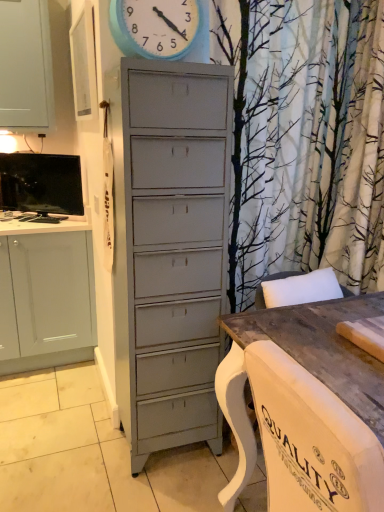
Question: Does matte black tv at upper left have a greater height compared to blue painted wood clock at upper center?

Choices:
 (A) no
 (B) yes

Answer: (B)

Question: Is matte black tv at upper left bigger than blue painted wood clock at upper center?

Choices:
 (A) yes
 (B) no

Answer: (A)

Question: Is matte black tv at upper left surrounding blue painted wood clock at upper center?

Choices:
 (A) yes
 (B) no

Answer: (B)

Question: Can you confirm if matte black tv at upper left is positioned to the left of blue painted wood clock at upper center?

Choices:
 (A) no
 (B) yes

Answer: (B)

Question: Is matte black tv at upper left positioned far away from blue painted wood clock at upper center?

Choices:
 (A) yes
 (B) no

Answer: (A)

Question: From a real-world perspective, is blue painted wood clock at upper center physically located above or below matte black tv at upper left?

Choices:
 (A) below
 (B) above

Answer: (B)

Question: In terms of height, does blue painted wood clock at upper center look taller or shorter compared to matte black tv at upper left?

Choices:
 (A) tall
 (B) short

Answer: (B)

Question: Relative to matte black tv at upper left, is blue painted wood clock at upper center in front or behind?

Choices:
 (A) behind
 (B) front

Answer: (B)

Question: Is blue painted wood clock at upper center spatially inside matte black tv at upper left, or outside of it?

Choices:
 (A) inside
 (B) outside

Answer: (B)

Question: From a real-world perspective, is matte black tv at upper left physically located above or below blue painted wood clock at upper center?

Choices:
 (A) below
 (B) above

Answer: (A)

Question: Relative to blue painted wood clock at upper center, is matte black tv at upper left in front or behind?

Choices:
 (A) behind
 (B) front

Answer: (A)

Question: Is point (64, 175) positioned closer to the camera than point (132, 23)?

Choices:
 (A) closer
 (B) farther

Answer: (B)

Question: Visually, is matte black tv at upper left positioned to the left or to the right of blue painted wood clock at upper center?

Choices:
 (A) left
 (B) right

Answer: (A)

Question: In terms of width, does wooden table at lower right look wider or thinner when compared to matte black tv at upper left?

Choices:
 (A) wide
 (B) thin

Answer: (A)

Question: Relative to matte black tv at upper left, is wooden table at lower right in front or behind?

Choices:
 (A) behind
 (B) front

Answer: (B)